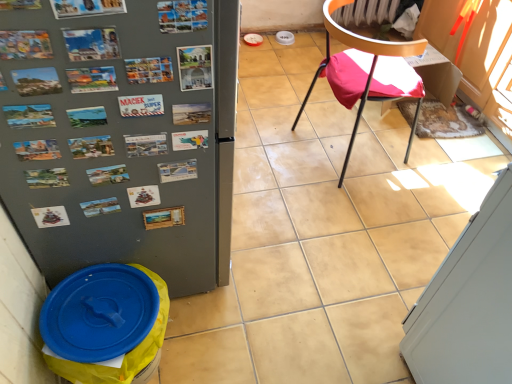
Locate an element on the screen. free spot below metallic black chair at center right (from a real-world perspective) is located at coordinates coord(354,152).